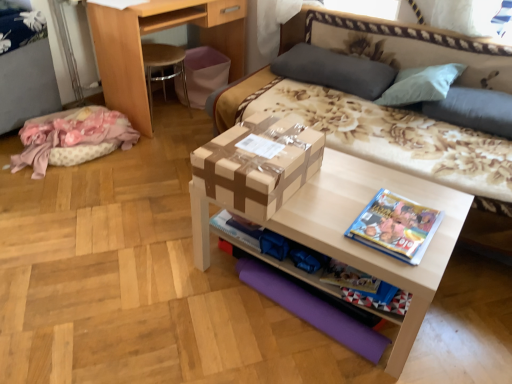
The height and width of the screenshot is (384, 512). I want to click on free space to the right of blue glossy book at right, so [443, 220].